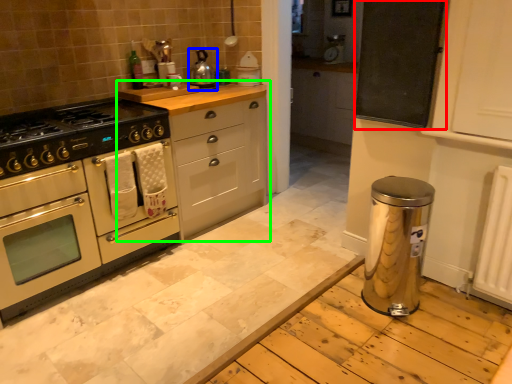
Question: Which object is positioned farthest from bulletin board (highlighted by a red box)? Select from kitchen appliance (highlighted by a blue box) and cabinetry (highlighted by a green box).

Choices:
 (A) kitchen appliance
 (B) cabinetry

Answer: (A)